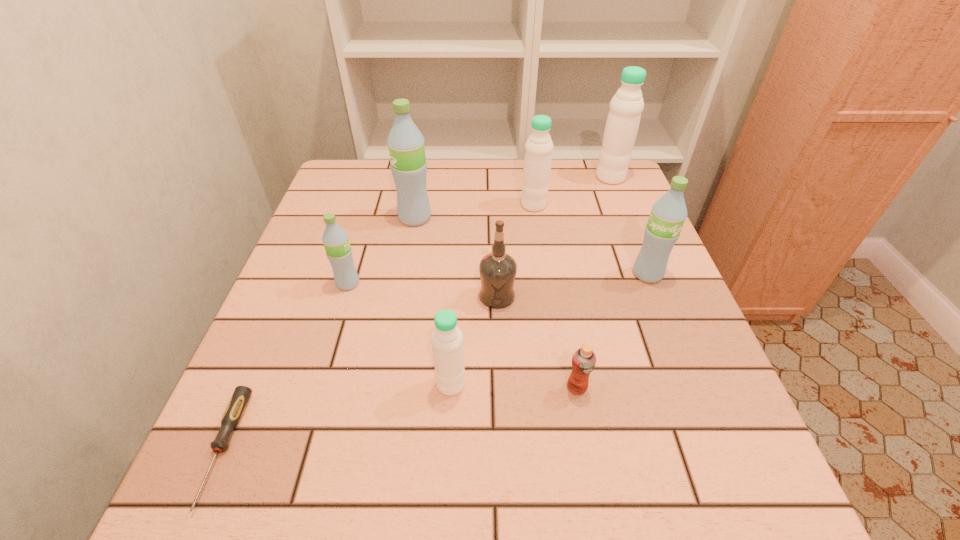
The height and width of the screenshot is (540, 960). I want to click on vacant area that satisfies the following two spatial constraints: 1. on the front label of the vodka; 2. on the left side of the orange juice, so [x=500, y=388].